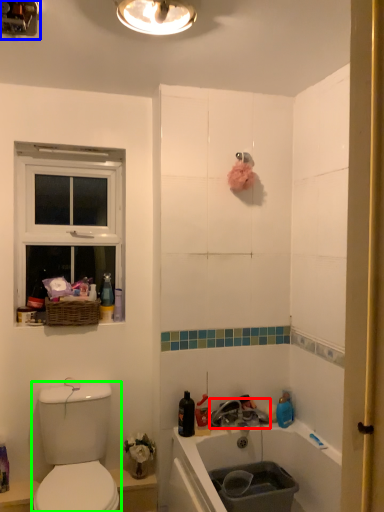
Question: Which is nearer to the tap (highlighted by a red box)? light fixture (highlighted by a blue box) or sink (highlighted by a green box).

Choices:
 (A) light fixture
 (B) sink

Answer: (B)